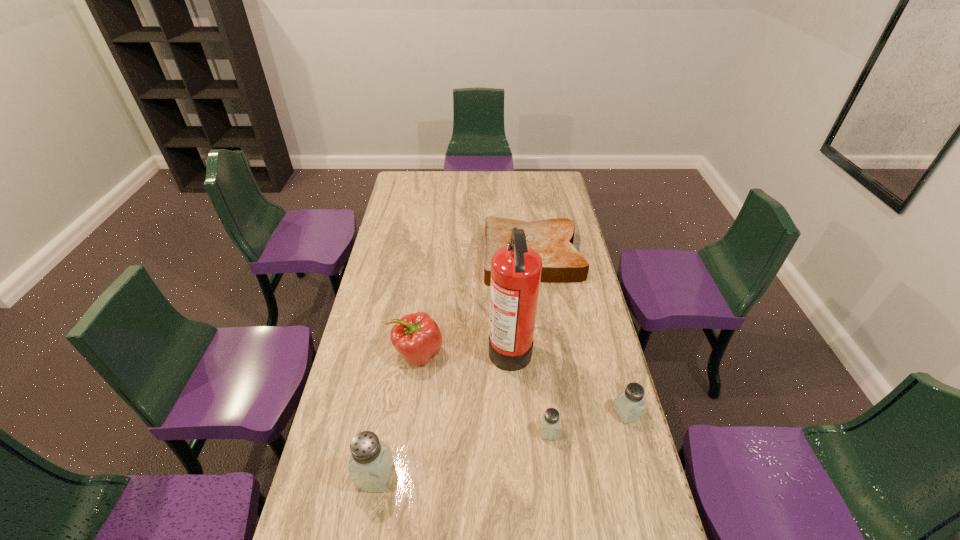
Point out which saltshaker is positioned as the third nearest to the bread. Please provide its 2D coordinates. Your answer should be formatted as a tuple, i.e. [(x, y)], where the tuple contains the x and y coordinates of a point satisfying the conditions above.

[(371, 461)]

At what (x,y) coordinates should I click in order to perform the action: click on vacant space that satisfies the following two spatial constraints: 1. on the front side of the farthest object; 2. on the front-facing side of the tallest object. Please return your answer as a coordinate pair (x, y). Looking at the image, I should click on point(544,346).

Locate an element on the screen. vacant area in the image that satisfies the following two spatial constraints: 1. on the front-facing side of the fire extinguisher; 2. on the right side of the second shortest object is located at coordinates (516, 432).

Locate an element on the screen. Image resolution: width=960 pixels, height=540 pixels. free region that satisfies the following two spatial constraints: 1. on the front-facing side of the tallest object; 2. on the front side of the leftmost saltshaker is located at coordinates (518, 475).